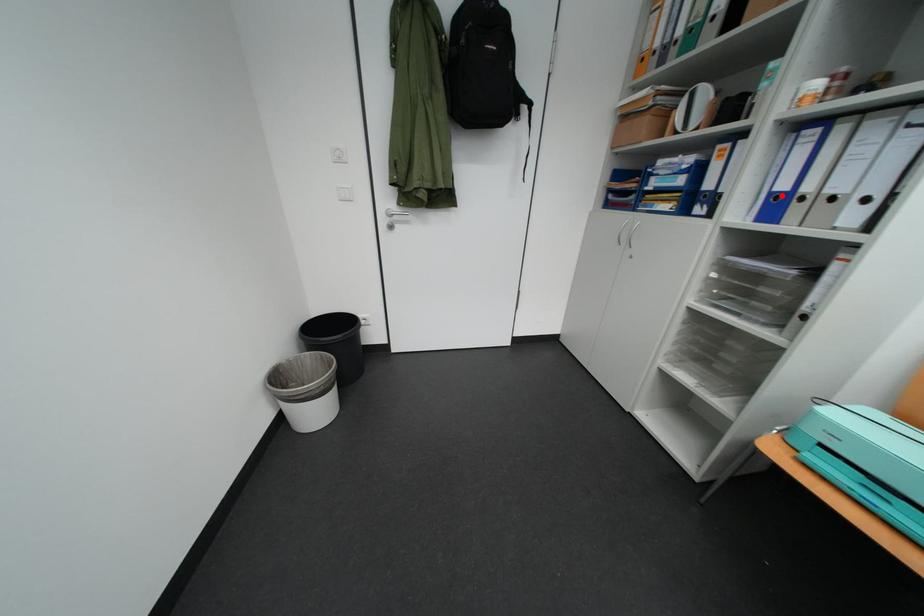
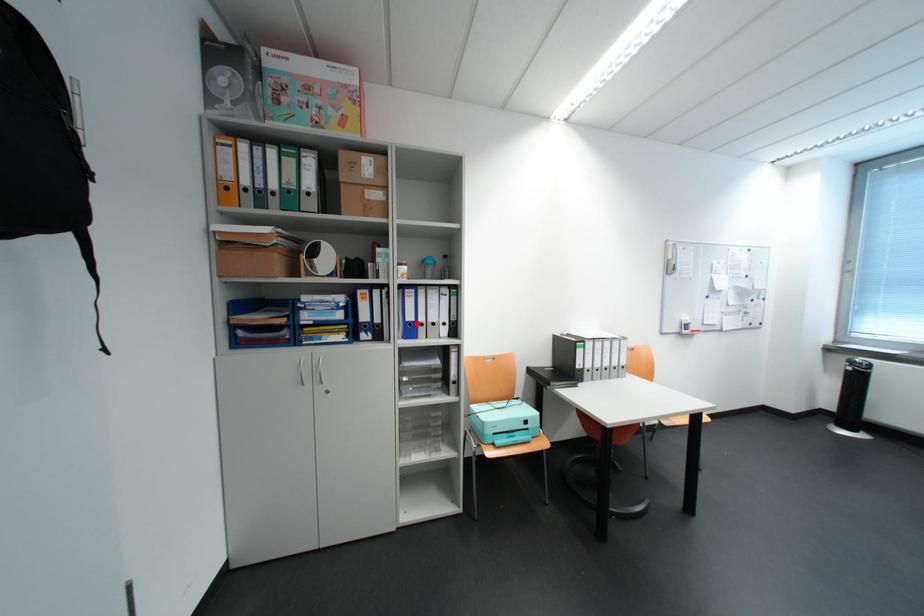
I am providing you with two images of the same scene from different viewpoints. A red point is marked on the first image and another point is marked on the second image. Is the marked point in image1 the same physical position as the marked point in image2?

Yes